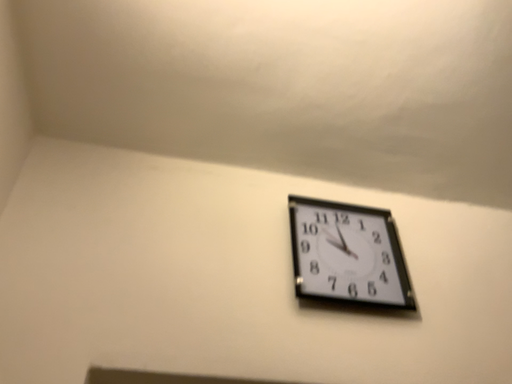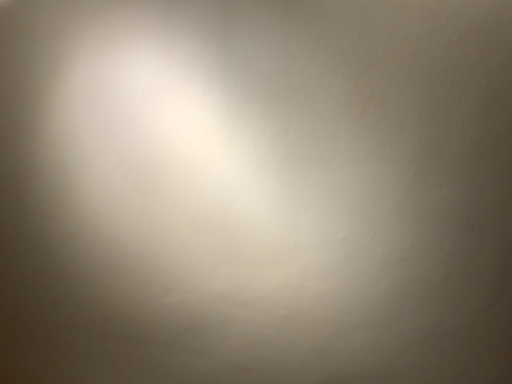
Question: How did the camera likely rotate when shooting the video?

Choices:
 (A) rotated upward
 (B) rotated downward

Answer: (A)